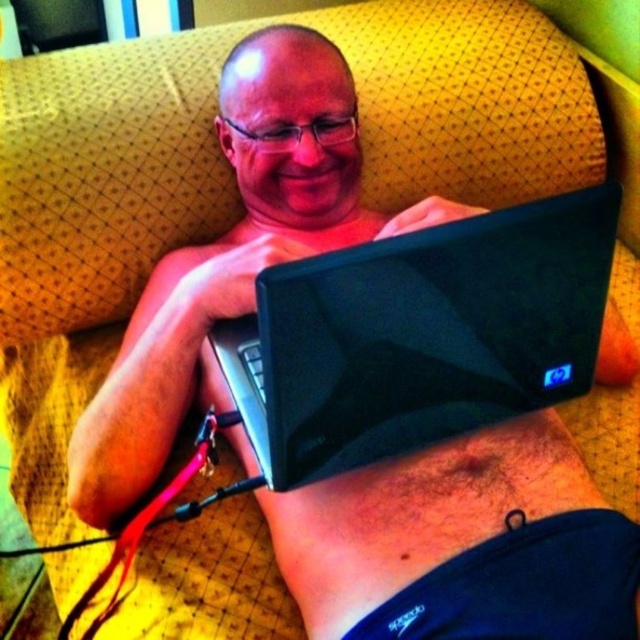
Based on the photo, you are a delivery robot trying to navigate to a package located at point (330, 492). There is an obstacle at point (451, 289). Will you be able to reach the package without passing through the obstacle?

Point (451, 289) is in front of point (330, 492), so the obstacle is blocking the path to the package. The delivery robot will not be able to reach the package without passing through the obstacle.

You are a photographer who needs to capture a closeup shot of the black glossy laptop at center and the hairy skin at center. Since the camera can only focus on one subject at a time, which subject should you choose if you want the one that is closer to the camera?

The black glossy laptop at center is positioned on the left side of hairy skin at center, so the hairy skin at center is closer to the camera. Choose the hairy skin at center.